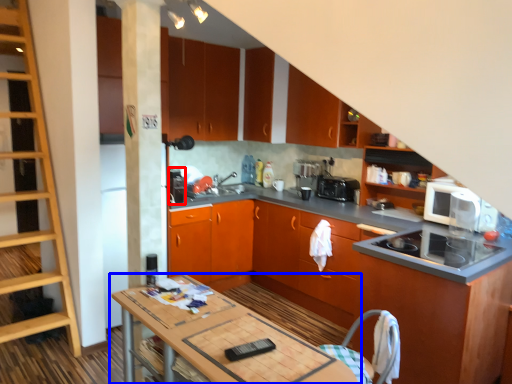
Question: Which of the following is the farthest to the observer, appliance (highlighted by a red box) or table (highlighted by a blue box)?

Choices:
 (A) appliance
 (B) table

Answer: (A)